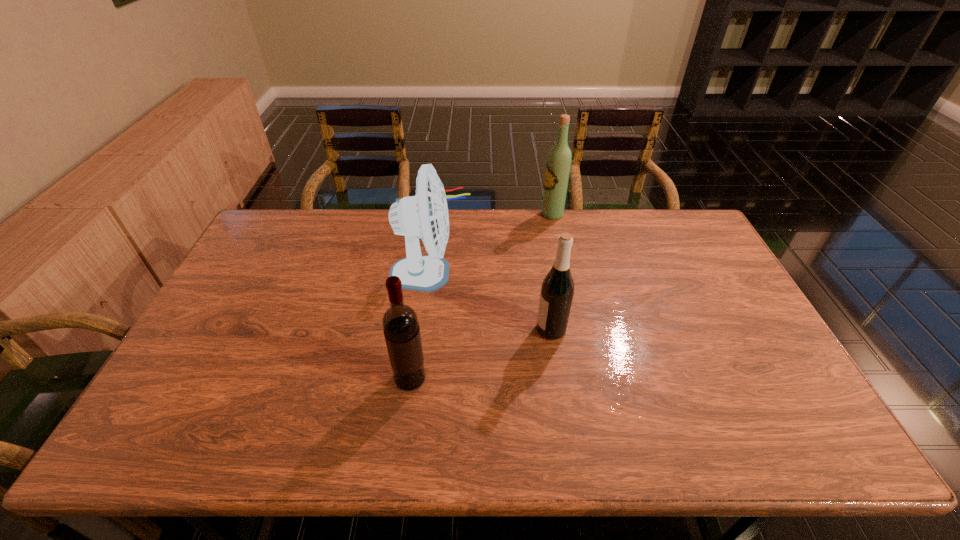
You are a GUI agent. You are given a task and a screenshot of the screen. Output one action in this format:
    pyautogui.click(x=<x>, y=<y>)
    Task: Click on the vacant area that lies between the nearest object and the second nearest wine bottle
    
    Given the screenshot: What is the action you would take?
    481,354

The image size is (960, 540). Find the location of `free point between the third farthest object and the leftmost wine bottle`. free point between the third farthest object and the leftmost wine bottle is located at coordinates 481,354.

Identify the location of vacant point located between the nearest wine bottle and the farthest wine bottle. The height and width of the screenshot is (540, 960). (481, 296).

Locate an element on the screen. Image resolution: width=960 pixels, height=540 pixels. empty space that is in between the fan and the second farthest wine bottle is located at coordinates (491, 301).

At what (x,y) coordinates should I click in order to perform the action: click on vacant space in between the leftmost wine bottle and the third nearest object. Please return your answer as a coordinate pair (x, y). Looking at the image, I should click on (420, 326).

This screenshot has height=540, width=960. Identify the location of free point between the nearest object and the fan. (420, 326).

Where is `vacant region between the leftmost wine bottle and the farthest object`? Image resolution: width=960 pixels, height=540 pixels. vacant region between the leftmost wine bottle and the farthest object is located at coordinates (481, 296).

Choose which object is the third nearest neighbor to the second nearest wine bottle. Please provide its 2D coordinates. Your answer should be formatted as a tuple, i.e. [(x, y)], where the tuple contains the x and y coordinates of a point satisfying the conditions above.

[(558, 165)]

Point out which object is positioned as the third nearest to the farthest object. Please provide its 2D coordinates. Your answer should be formatted as a tuple, i.e. [(x, y)], where the tuple contains the x and y coordinates of a point satisfying the conditions above.

[(400, 323)]

Choose which wine bottle is the second nearest neighbor to the farthest wine bottle. Please provide its 2D coordinates. Your answer should be formatted as a tuple, i.e. [(x, y)], where the tuple contains the x and y coordinates of a point satisfying the conditions above.

[(400, 323)]